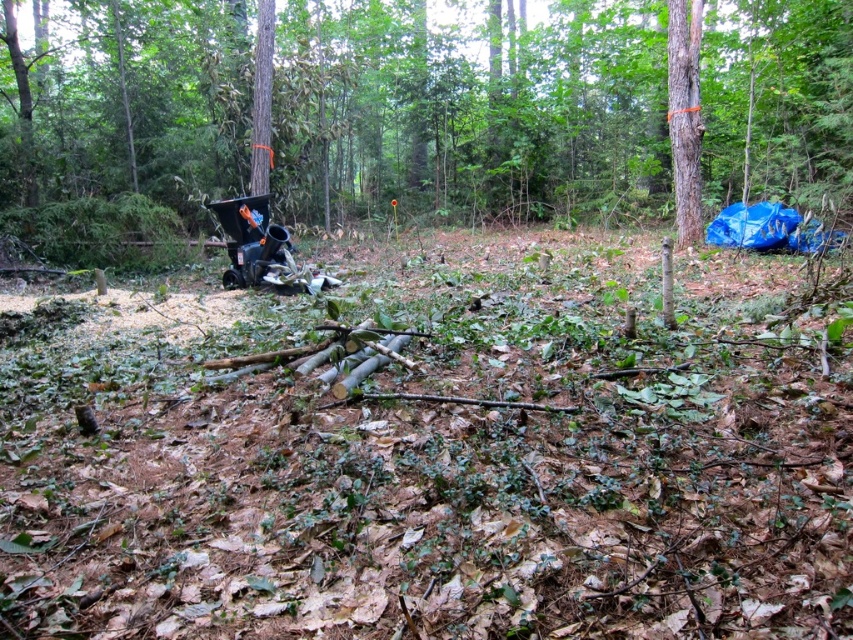
You are a parent with a child in the matte black baby carriage at center. You want to push the carriage through a narrow path between two trees. The smooth bark tree at center is one of them. Based on their heights, do you think the carriage will fit under the branches?

The matte black baby carriage at center is shorter than the smooth bark tree at center. Since the carriage is shorter, it should fit under the branches as long as the path isn not blocked by other obstacles.

You are a parent pushing a matte black baby carriage at center through a wooded area. There is a smooth bark tree at right nearby. Which direction should you turn to face the tree?

You should turn to your right to face the smooth bark tree at right, since it is located to the right of the matte black baby carriage at center.